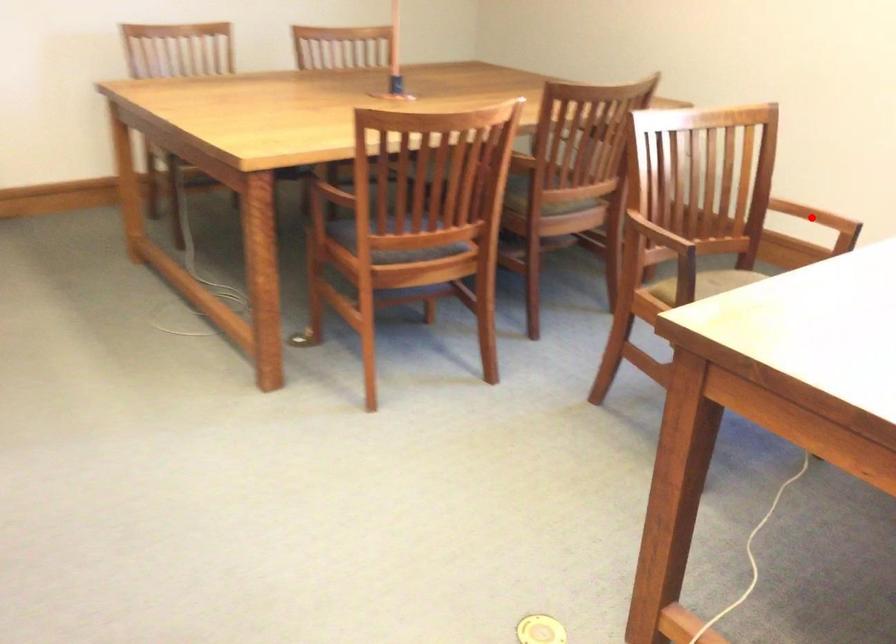
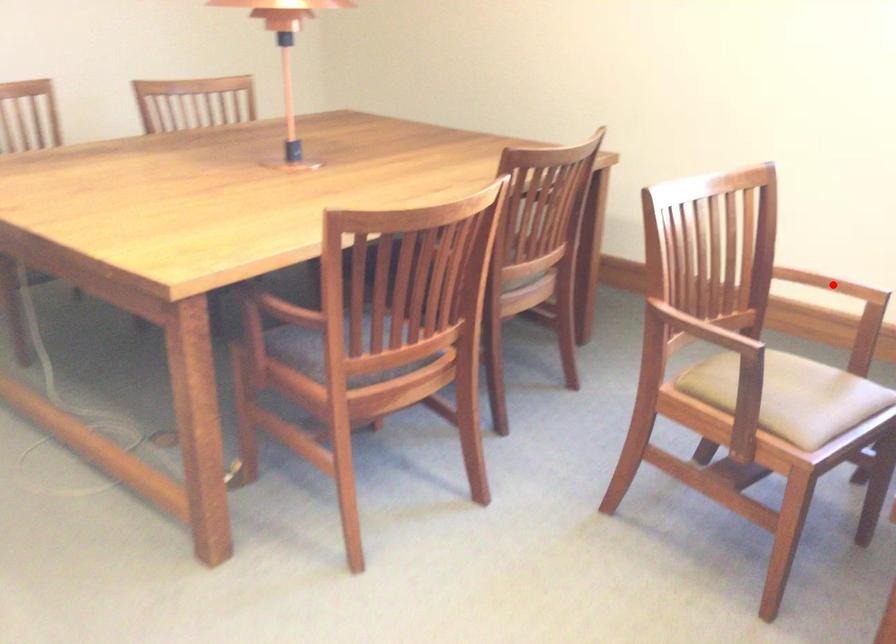
I am providing you with two images of the same scene from different viewpoints. A red point is marked on the first image and another point is marked on the second image. Do the highlighted points in image1 and image2 indicate the same real-world spot?

Yes